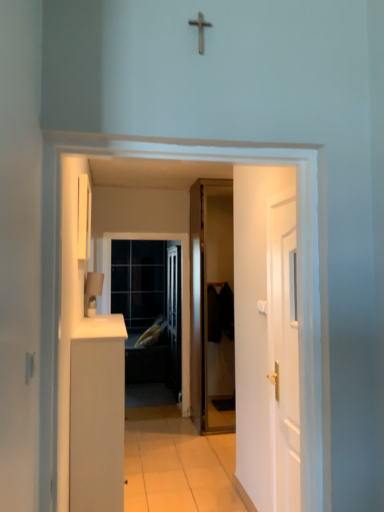
Question: From the image's perspective, is transparent glass door at center below black matte door at center, the 1th door in the left-to-right sequence?

Choices:
 (A) no
 (B) yes

Answer: (B)

Question: Is transparent glass door at center touching black matte door at center, positioned as the 1th door in back-to-front order?

Choices:
 (A) no
 (B) yes

Answer: (A)

Question: Considering the relative sizes of transparent glass door at center and black matte door at center, the 2th door from the right, in the image provided, is transparent glass door at center bigger than black matte door at center, the 2th door from the right,?

Choices:
 (A) yes
 (B) no

Answer: (B)

Question: Is transparent glass door at center at the left side of black matte door at center, the 2th door from the right?

Choices:
 (A) no
 (B) yes

Answer: (B)

Question: Considering the relative positions of transparent glass door at center and black matte door at center, positioned as the 1th door in back-to-front order, in the image provided, is transparent glass door at center in front of black matte door at center, positioned as the 1th door in back-to-front order,?

Choices:
 (A) no
 (B) yes

Answer: (A)

Question: Is white tile floor at center spatially inside white matte cabinet at left, or outside of it?

Choices:
 (A) outside
 (B) inside

Answer: (A)

Question: Is white tile floor at center in front of or behind white matte cabinet at left in the image?

Choices:
 (A) behind
 (B) front

Answer: (A)

Question: Visually, is white tile floor at center positioned to the left or to the right of white matte cabinet at left?

Choices:
 (A) right
 (B) left

Answer: (A)

Question: Based on their sizes in the image, would you say white tile floor at center is bigger or smaller than white matte cabinet at left?

Choices:
 (A) big
 (B) small

Answer: (B)

Question: From their relative heights in the image, would you say white wooden door at right, the 2th door viewed from the back, is taller or shorter than transparent glass door at center?

Choices:
 (A) tall
 (B) short

Answer: (B)

Question: Which is correct: white wooden door at right, the 2th door viewed from the back, is inside transparent glass door at center, or outside of it?

Choices:
 (A) inside
 (B) outside

Answer: (B)

Question: Relative to transparent glass door at center, is white wooden door at right, arranged as the second door when viewed from the left, in front or behind?

Choices:
 (A) behind
 (B) front

Answer: (B)

Question: Considering the positions of point (274, 320) and point (122, 310), is point (274, 320) closer or farther from the camera than point (122, 310)?

Choices:
 (A) farther
 (B) closer

Answer: (B)

Question: Do you think matte glass screen door at center is within white tile floor at center, or outside of it?

Choices:
 (A) inside
 (B) outside

Answer: (B)

Question: In the image, is matte glass screen door at center on the left side or the right side of white tile floor at center?

Choices:
 (A) left
 (B) right

Answer: (A)